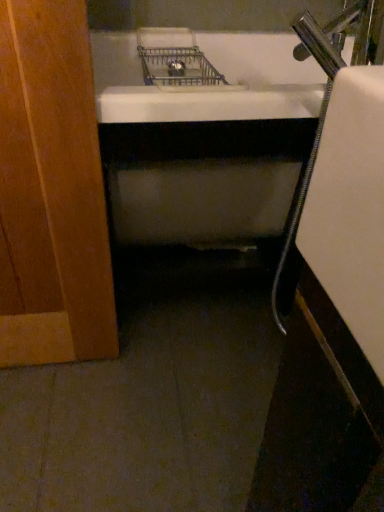
You are a GUI agent. You are given a task and a screenshot of the screen. Output one action in this format:
    pyautogui.click(x=<x>, y=<y>)
    Task: Click on the silver metallic faucet at right
    The image size is (384, 512).
    Given the screenshot: What is the action you would take?
    pyautogui.click(x=327, y=96)

The image size is (384, 512). Describe the element at coordinates (327, 96) in the screenshot. I see `silver metallic faucet at right` at that location.

Where is `silver metallic faucet at right`? Image resolution: width=384 pixels, height=512 pixels. silver metallic faucet at right is located at coordinates (327, 96).